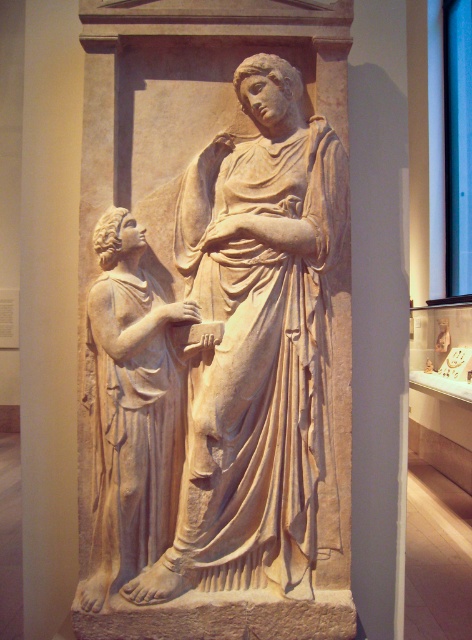
Who is positioned more to the right, beige stone statue at center or white marble statue at left?

beige stone statue at center is more to the right.

Can you confirm if beige stone statue at center is positioned above white marble statue at left?

Indeed, beige stone statue at center is positioned over white marble statue at left.

Who is more forward, (293, 273) or (128, 467)?

Point (128, 467) is more forward.

This screenshot has width=472, height=640. In order to click on beige stone statue at center in this screenshot , I will do `click(259, 348)`.